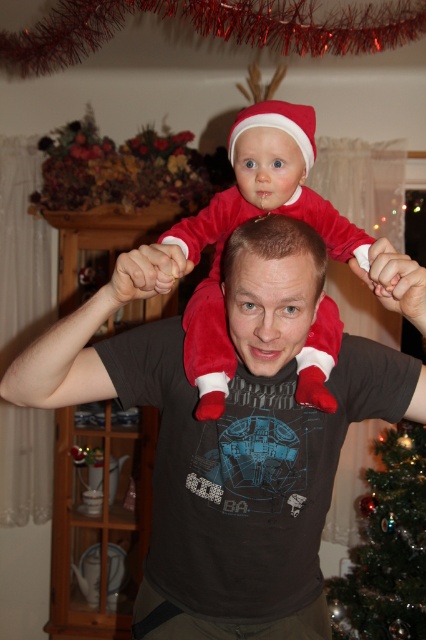
Question: Which point is closer to the camera?

Choices:
 (A) matte red santa hat at center
 (B) velvet red santa suit at center

Answer: (A)

Question: Does velvet red santa suit at center have a larger size compared to matte red santa hat at center?

Choices:
 (A) no
 (B) yes

Answer: (B)

Question: Which point is closer to the camera?

Choices:
 (A) (264, 323)
 (B) (219, 381)
 (C) (316, 289)
 (D) (403, 433)

Answer: (A)

Question: Is matte black t-shirt at center above matte red santa hat at center?

Choices:
 (A) yes
 (B) no

Answer: (B)

Question: Does matte black t-shirt at center come in front of shiny green christmas tree at lower right?

Choices:
 (A) yes
 (B) no

Answer: (A)

Question: Which object appears closest to the camera in this image?

Choices:
 (A) matte red santa hat at center
 (B) matte black t-shirt at center

Answer: (A)